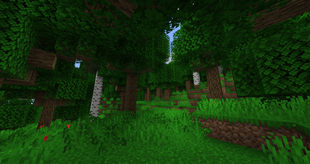
Find the location of a particular element. ceiling is located at coordinates (247, 11).